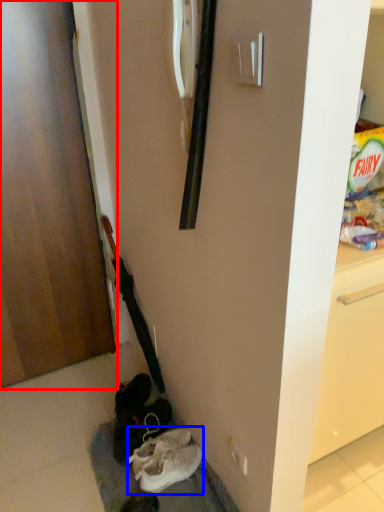
Question: Which point is further to the camera, door (highlighted by a red box) or footwear (highlighted by a blue box)?

Choices:
 (A) door
 (B) footwear

Answer: (B)